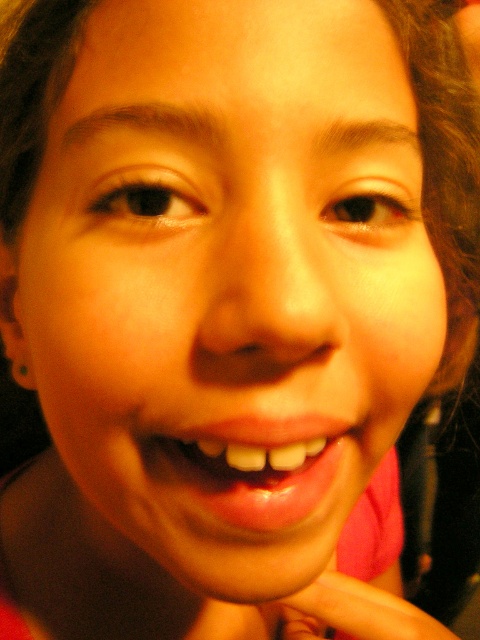
You are a makeup artist observing the image. You need to apply lipstick to the shiny pink lips at center without accidentally touching the pink matte hand at lower center. Based on their positions, which object should you target first to avoid the hand?

The shiny pink lips at center should be targeted first since it is located above the pink matte hand at lower center, so applying lipstick to the lips first would avoid contact with the hand below.

You are an artist sketching this face. You need to decide the vertical positioning of the shiny pink lips at center and the pink matte hand at lower center. Which one should you place higher on the paper to match the image?

The shiny pink lips at center has a lesser height compared to pink matte hand at lower center, so you should place the shiny pink lips at center higher than the pink matte hand at lower center to match the image.